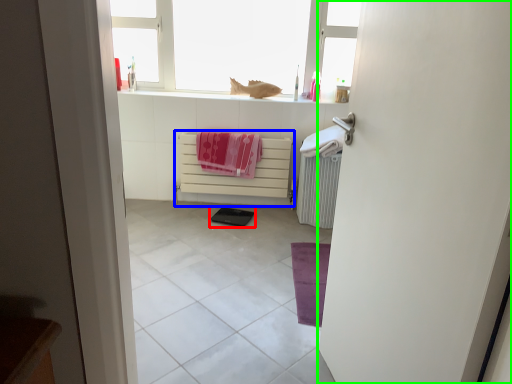
Question: Based on their relative distances, which object is farther from pad (highlighted by a red box)? Choose from cabinetry (highlighted by a blue box) and door (highlighted by a green box).

Choices:
 (A) cabinetry
 (B) door

Answer: (B)